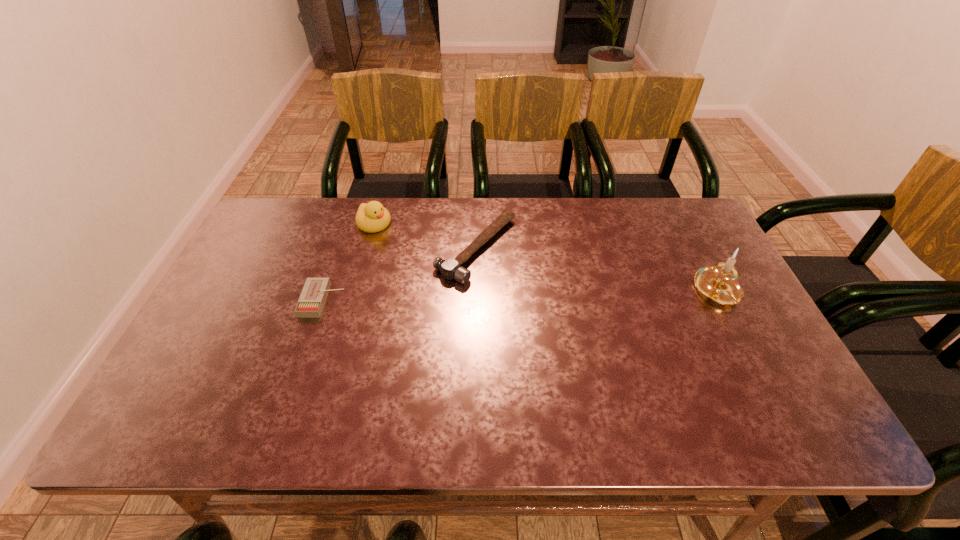
What are the coordinates of `matchbox` in the screenshot? It's located at (313, 296).

What are the coordinates of `the tallest object` in the screenshot? It's located at (718, 283).

Identify the location of the rightmost object. [718, 283].

Identify the location of hammer. Image resolution: width=960 pixels, height=540 pixels. (449, 268).

You are a GUI agent. You are given a task and a screenshot of the screen. Output one action in this format:
    pyautogui.click(x=<x>, y=<y>)
    Task: Click on the duckling
    The height and width of the screenshot is (540, 960).
    Given the screenshot: What is the action you would take?
    pyautogui.click(x=371, y=217)

This screenshot has height=540, width=960. In order to click on blank area located 0.210m on the striking surface of the shortest object in this screenshot , I will do `click(420, 300)`.

Identify the location of vacant space located 0.180m on the handle side of the candle holder. (762, 375).

This screenshot has height=540, width=960. I want to click on vacant region located 0.400m on the striking face of the hammer, so click(x=648, y=334).

Identify the location of free space located 0.070m on the striking face of the hammer. (533, 280).

Identify the location of free region located on the striking face of the hammer. The image size is (960, 540). (595, 309).